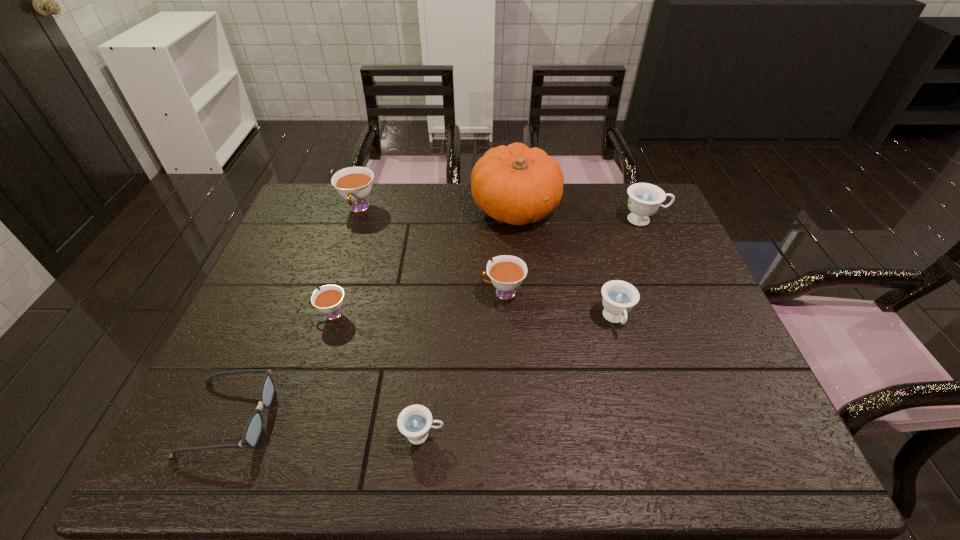
The width and height of the screenshot is (960, 540). What are the coordinates of `the nearest blue teacup` in the screenshot? It's located at (414, 422).

I want to click on the smallest blue teacup, so click(414, 422).

Identify the location of gray spectacles. The height and width of the screenshot is (540, 960). 254,426.

Where is `free space located on the front of the orange pumpkin`? The width and height of the screenshot is (960, 540). free space located on the front of the orange pumpkin is located at coordinates (524, 295).

This screenshot has height=540, width=960. Find the location of `blank space located on the side of the biggest white teacup with the handle`. blank space located on the side of the biggest white teacup with the handle is located at coordinates (347, 245).

Locate an element on the screen. This screenshot has height=540, width=960. blank space located on the side of the rightmost white teacup with the handle is located at coordinates 380,293.

Locate an element on the screen. The width and height of the screenshot is (960, 540). free region located on the side of the rightmost white teacup with the handle is located at coordinates (370, 293).

The width and height of the screenshot is (960, 540). Find the location of `vacant region located on the side of the rightmost white teacup with the handle`. vacant region located on the side of the rightmost white teacup with the handle is located at coordinates (414, 293).

What are the coordinates of `free space located 0.200m on the side of the second object from right to left with the handle` in the screenshot? It's located at (641, 413).

Image resolution: width=960 pixels, height=540 pixels. What are the coordinates of `vacant position located on the side of the smallest white teacup with the handle` in the screenshot? It's located at (276, 314).